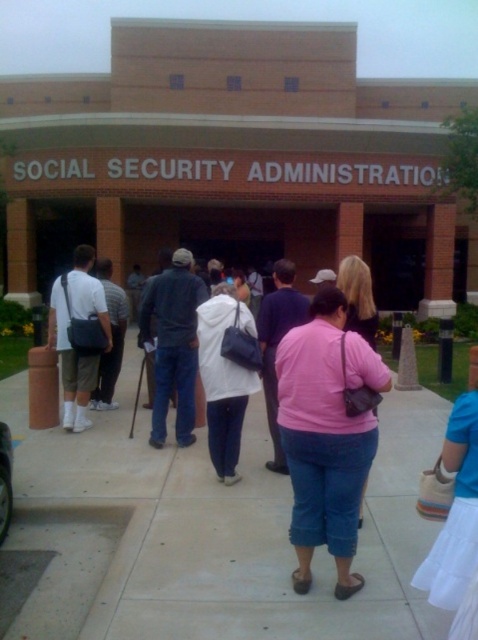
Question: Can you confirm if pink matte shirt at center is positioned to the right of white matte shirt at center?

Choices:
 (A) no
 (B) yes

Answer: (B)

Question: Among these objects, which one is nearest to the camera?

Choices:
 (A) cement sidewalk at center
 (B) white matte shirt at center

Answer: (A)

Question: Is pink matte shirt at center in front of white matte shirt at center?

Choices:
 (A) no
 (B) yes

Answer: (B)

Question: Which point is farther to the camera?

Choices:
 (A) (66, 312)
 (B) (201, 609)

Answer: (A)

Question: Does cement sidewalk at center have a greater width compared to white matte shirt at center?

Choices:
 (A) yes
 (B) no

Answer: (A)

Question: Which point is closer to the camera?

Choices:
 (A) cement sidewalk at center
 (B) white matte shirt at center
 (C) pink matte shirt at center

Answer: (C)